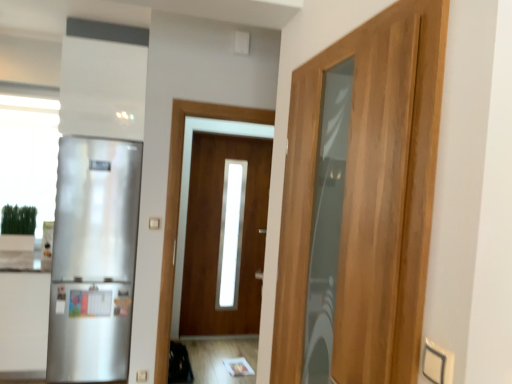
Question: In the image, is satin white cabinet at left positioned in front of or behind wooden door at center, which is counted as the first door, starting from the back?

Choices:
 (A) front
 (B) behind

Answer: (A)

Question: Does point (28, 281) appear closer or farther from the camera than point (220, 208)?

Choices:
 (A) farther
 (B) closer

Answer: (B)

Question: Which is farther from the satin white cabinet at left?

Choices:
 (A) wooden door at center, acting as the second door starting from the right
 (B) wooden door at right, which is the 1th door from right to left
 (C) satin silver refrigerator at left

Answer: (B)

Question: Which object is the closest to the satin silver refrigerator at left?

Choices:
 (A) wooden door at center, acting as the second door starting from the right
 (B) satin white cabinet at left
 (C) wooden door at right, which is counted as the second door, starting from the back

Answer: (B)